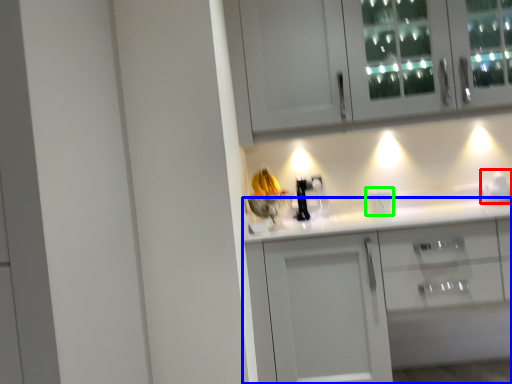
Question: Which object is the closest to the appliance (highlighted by a red box)? Choose among these: cabinetry (highlighted by a blue box) or electric outlet (highlighted by a green box).

Choices:
 (A) cabinetry
 (B) electric outlet

Answer: (B)